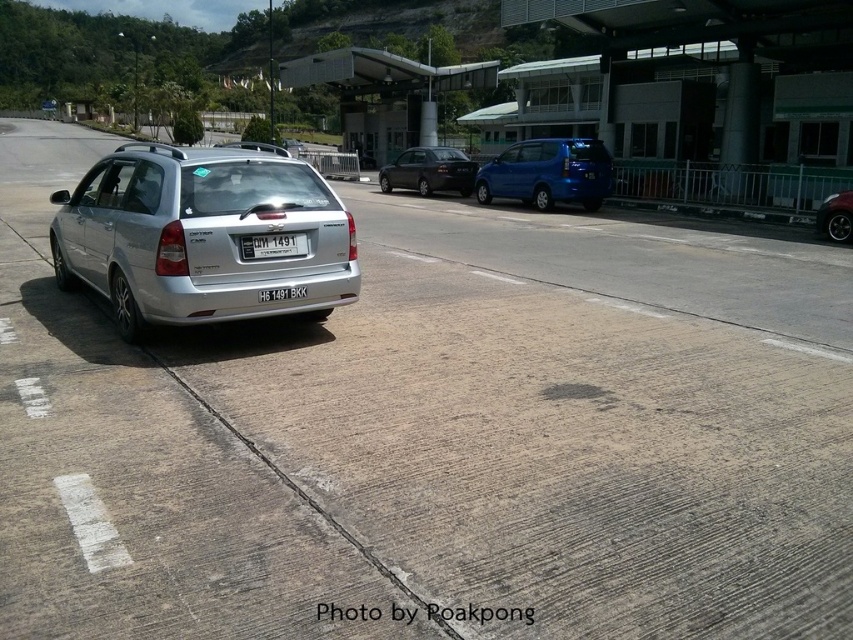
Between gray concrete curb at lower center and shiny black car at right, which one has less height?

gray concrete curb at lower center is shorter.

Does point (428, 616) come closer to viewer compared to point (846, 204)?

Yes, point (428, 616) is closer to viewer.

At what (x,y) coordinates should I click in order to perform the action: click on gray concrete curb at lower center. Please return your answer as a coordinate pair (x, y). Image resolution: width=853 pixels, height=640 pixels. Looking at the image, I should click on (310, 500).

This screenshot has width=853, height=640. What do you see at coordinates (201, 236) in the screenshot?
I see `silver metallic hatchback at left` at bounding box center [201, 236].

Is silver metallic hatchback at left bigger than gray concrete curb at lower center?

Yes.

Image resolution: width=853 pixels, height=640 pixels. I want to click on silver metallic hatchback at left, so 201,236.

Looking at this image, is shiny black sedan at center taller than shiny black car at right?

Yes.

Is shiny black sedan at center to the left of shiny black car at right from the viewer's perspective?

Yes, shiny black sedan at center is to the left of shiny black car at right.

Looking at this image, who is more forward, [444,188] or [846,220]?

Point [846,220] is more forward.

The width and height of the screenshot is (853, 640). What are the coordinates of `shiny black sedan at center` in the screenshot? It's located at (428, 172).